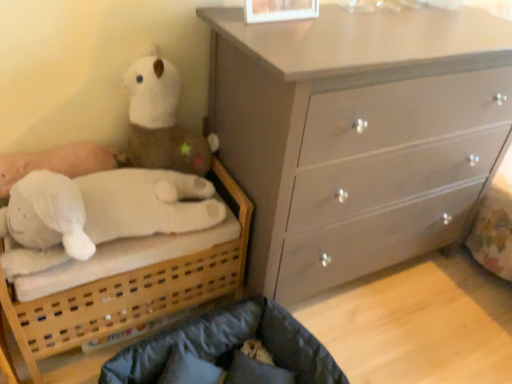
Question: From a real-world perspective, does velvety dark blue pillow at lower center stand above light gray wooden chest of drawers at upper right?

Choices:
 (A) no
 (B) yes

Answer: (A)

Question: From a real-world perspective, is velvety dark blue pillow at lower center beneath light gray wooden chest of drawers at upper right?

Choices:
 (A) no
 (B) yes

Answer: (B)

Question: Is velvety dark blue pillow at lower center in contact with light gray wooden chest of drawers at upper right?

Choices:
 (A) no
 (B) yes

Answer: (A)

Question: Considering the relative sizes of velvety dark blue pillow at lower center and light gray wooden chest of drawers at upper right in the image provided, is velvety dark blue pillow at lower center thinner than light gray wooden chest of drawers at upper right?

Choices:
 (A) no
 (B) yes

Answer: (B)

Question: Is velvety dark blue pillow at lower center positioned in front of light gray wooden chest of drawers at upper right?

Choices:
 (A) no
 (B) yes

Answer: (A)

Question: From the image's perspective, would you say velvety dark blue pillow at lower center is positioned over light gray wooden chest of drawers at upper right?

Choices:
 (A) no
 (B) yes

Answer: (A)

Question: Does white soft bed at left have a larger size compared to velvety dark blue pillow at lower center?

Choices:
 (A) no
 (B) yes

Answer: (B)

Question: Is white soft bed at left positioned with its back to velvety dark blue pillow at lower center?

Choices:
 (A) no
 (B) yes

Answer: (A)

Question: Is white soft bed at left thinner than velvety dark blue pillow at lower center?

Choices:
 (A) yes
 (B) no

Answer: (B)

Question: Considering the relative positions of white soft bed at left and velvety dark blue pillow at lower center in the image provided, is white soft bed at left in front of velvety dark blue pillow at lower center?

Choices:
 (A) yes
 (B) no

Answer: (A)

Question: Is white soft bed at left not within velvety dark blue pillow at lower center?

Choices:
 (A) yes
 (B) no

Answer: (A)

Question: Is velvety dark blue pillow at lower center surrounded by white soft bed at left?

Choices:
 (A) no
 (B) yes

Answer: (A)

Question: Would you consider dark gray fabric infant bed at lower center to be distant from white plush toy at upper left?

Choices:
 (A) no
 (B) yes

Answer: (A)